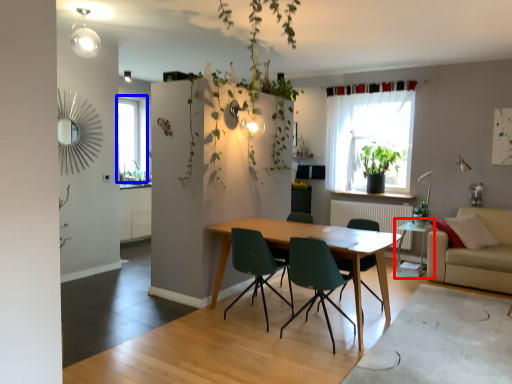
Question: Among these objects, which one is farthest to the camera, side table (highlighted by a red box) or window (highlighted by a blue box)?

Choices:
 (A) side table
 (B) window

Answer: (B)